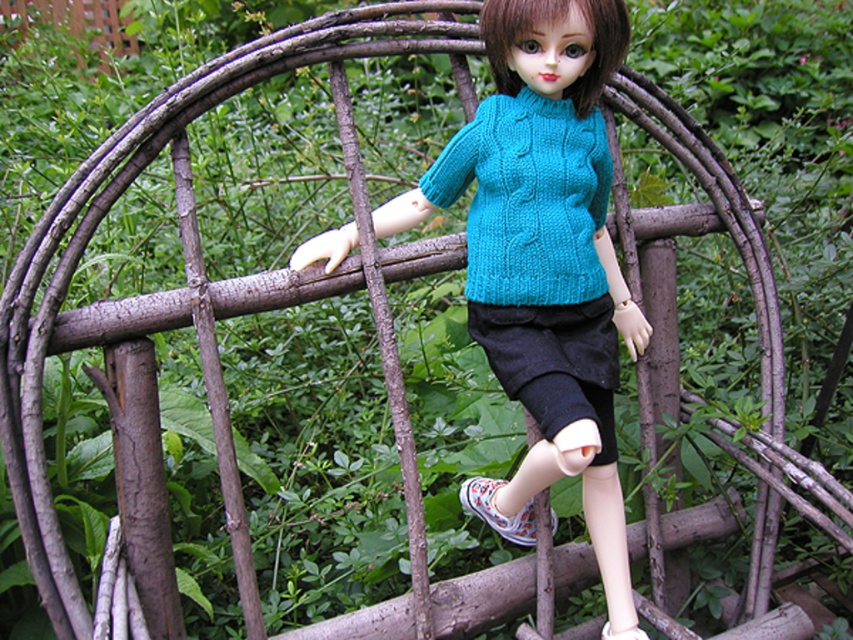
Which is more to the left, cable-knit teal sweater at center or white fabric shoe at lower right?

Positioned to the left is cable-knit teal sweater at center.

Is point (585, 289) positioned behind point (601, 628)?

That is False.

Where is `cable-knit teal sweater at center`? The width and height of the screenshot is (853, 640). cable-knit teal sweater at center is located at coordinates (527, 198).

From the picture: Can you confirm if turquoise knitted sweater at center is bigger than white fabric shoe at lower right?

Yes, turquoise knitted sweater at center is bigger than white fabric shoe at lower right.

Is turquoise knitted sweater at center to the left of white fabric shoe at lower right from the viewer's perspective?

Indeed, turquoise knitted sweater at center is positioned on the left side of white fabric shoe at lower right.

What do you see at coordinates (547, 266) in the screenshot?
I see `turquoise knitted sweater at center` at bounding box center [547, 266].

Where is `turquoise knitted sweater at center`? The width and height of the screenshot is (853, 640). turquoise knitted sweater at center is located at coordinates (547, 266).

Between point (488, 0) and point (521, 132), which one is positioned behind?

The point (521, 132) is behind.

Is turquoise knitted sweater at center taller than cable-knit teal sweater at center?

Yes, turquoise knitted sweater at center is taller than cable-knit teal sweater at center.

Is point (614, 352) positioned in front of point (541, 300)?

No.

You are a GUI agent. You are given a task and a screenshot of the screen. Output one action in this format:
    pyautogui.click(x=<x>, y=<y>)
    Task: Click on the turquoise knitted sweater at center
    
    Given the screenshot: What is the action you would take?
    pyautogui.click(x=547, y=266)